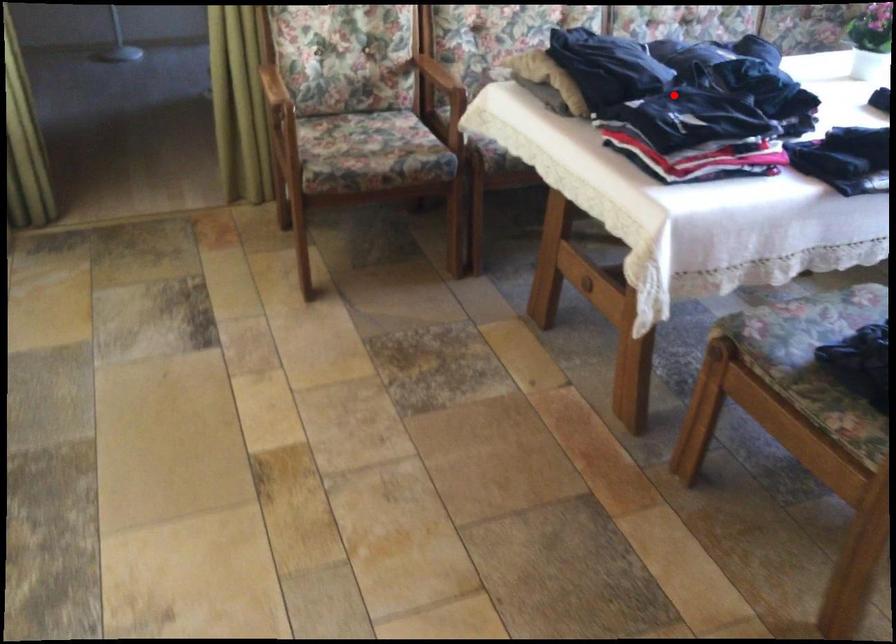
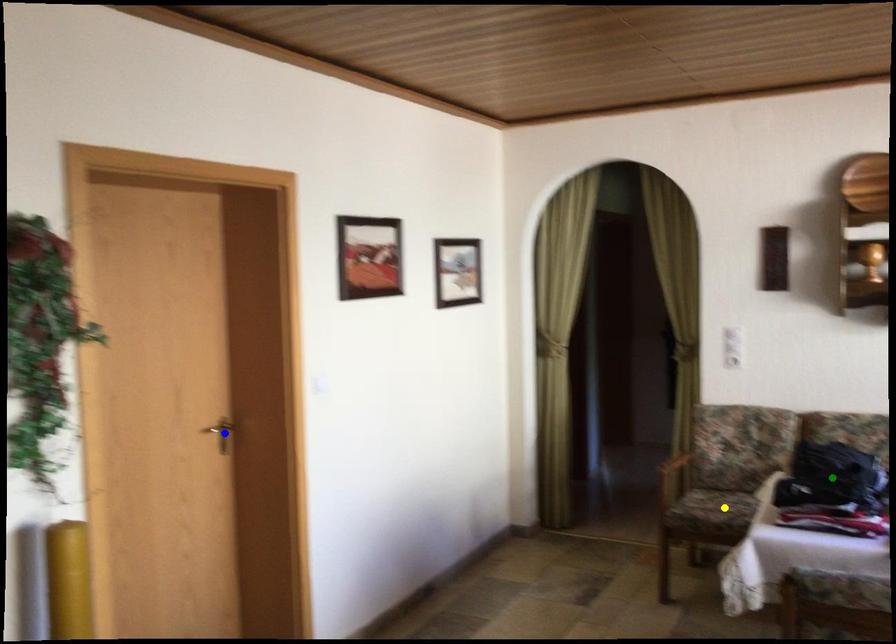
Question: I am providing you with two images of the same scene from different viewpoints. A red point is marked on the first image. You are given multiple points on the second image. Which mark in image 2 goes with the point in image 1?

Choices:
 (A) yellow point
 (B) green point
 (C) blue point

Answer: (B)